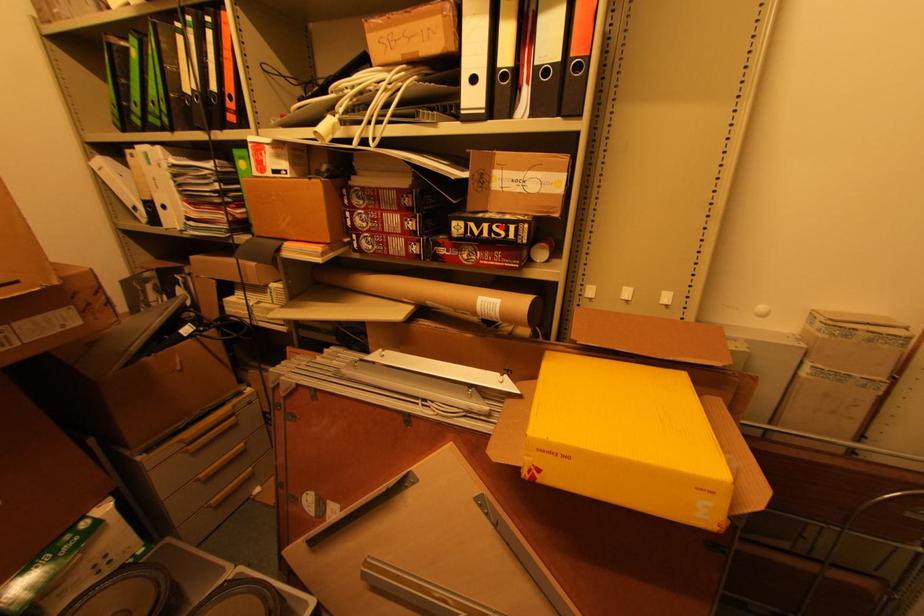
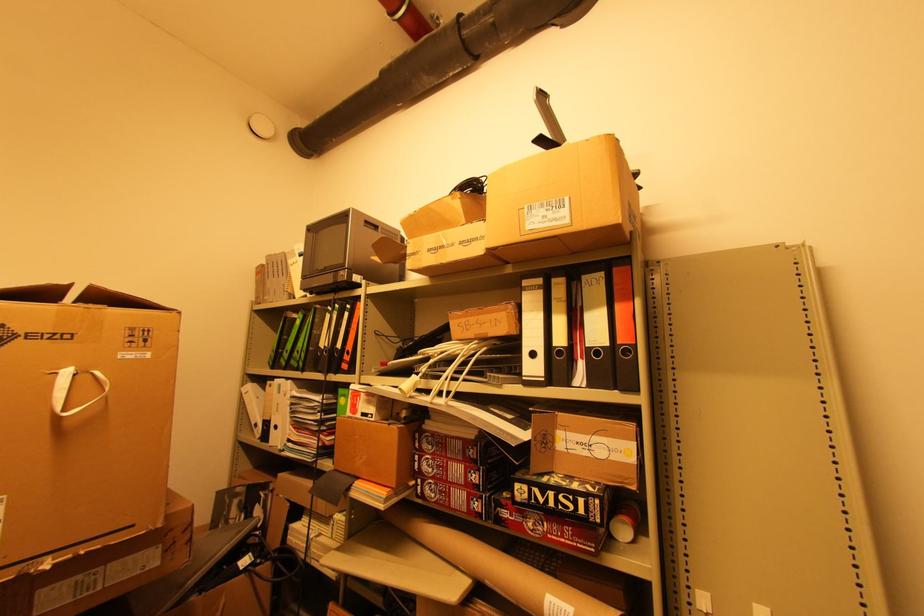
Where in the second image is the point corresponding to the highlighted location from the first image?

(568, 498)